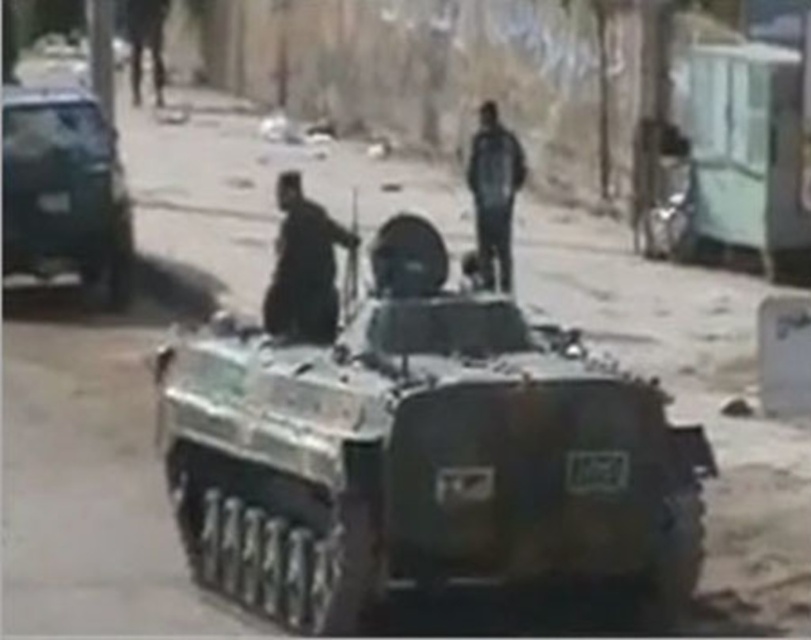
Can you confirm if camouflage-patterned tank at center is positioned above shiny black car at left?

Actually, camouflage-patterned tank at center is below shiny black car at left.

Between camouflage-patterned tank at center and shiny black car at left, which one is positioned lower?

camouflage-patterned tank at center

I want to click on camouflage-patterned tank at center, so click(423, 452).

Where is `camouflage-patterned tank at center`? This screenshot has height=640, width=811. camouflage-patterned tank at center is located at coordinates (423, 452).

Who is positioned more to the right, camouflage-patterned tank at center or dark blue fabric jacket at center?

From the viewer's perspective, dark blue fabric jacket at center appears more on the right side.

This screenshot has height=640, width=811. Find the location of `camouflage-patterned tank at center`. camouflage-patterned tank at center is located at coordinates (423, 452).

Is the position of shiny black car at left more distant than that of dark gray uniform at center?

Yes, it is behind dark gray uniform at center.

Can you confirm if shiny black car at left is bigger than dark gray uniform at center?

Indeed, shiny black car at left has a larger size compared to dark gray uniform at center.

Measure the distance between point (71,157) and camera.

Point (71,157) is 17.29 meters away from camera.

Locate an element on the screen. The image size is (811, 640). shiny black car at left is located at coordinates (63, 189).